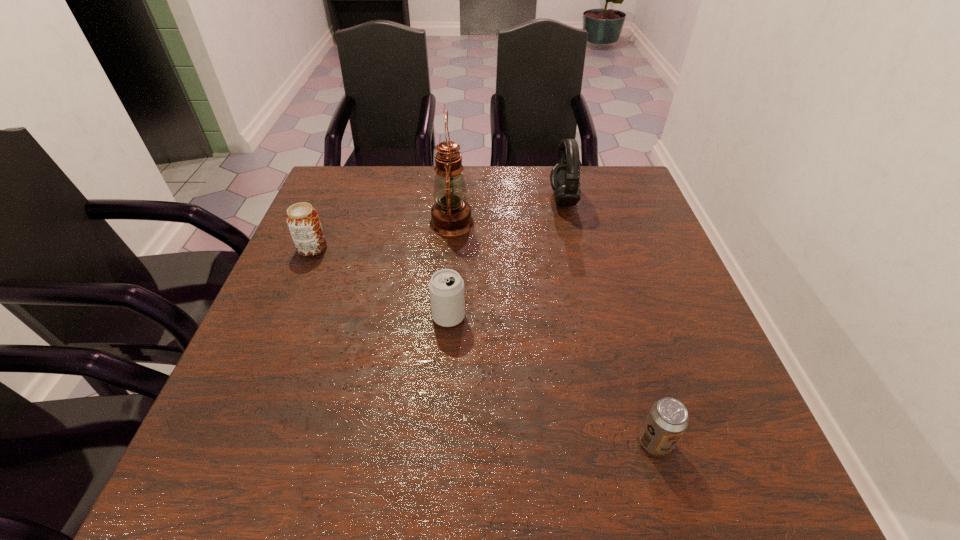
The height and width of the screenshot is (540, 960). In order to click on free space located on the earcups of the fourth shortest object in this screenshot , I will do pyautogui.click(x=421, y=200).

Identify the location of free space located on the right of the farther beer can. (367, 248).

Locate an element on the screen. The height and width of the screenshot is (540, 960). vacant region located on the front of the can is located at coordinates (446, 353).

Where is `vacant space positioned 0.060m on the right of the nearer beer can`? vacant space positioned 0.060m on the right of the nearer beer can is located at coordinates pyautogui.click(x=707, y=442).

At what (x,y) coordinates should I click in order to perform the action: click on oil lamp at the far edge. Please return your answer as a coordinate pair (x, y). The height and width of the screenshot is (540, 960). Looking at the image, I should click on (451, 215).

At what (x,y) coordinates should I click in order to perform the action: click on headset present at the far edge. Please return your answer as a coordinate pair (x, y). Looking at the image, I should click on (565, 175).

Locate an element on the screen. This screenshot has width=960, height=540. object present at the near edge is located at coordinates (667, 419).

You are a GUI agent. You are given a task and a screenshot of the screen. Output one action in this format:
    pyautogui.click(x=<x>, y=<y>)
    Task: Click on the object located at the left edge
    This screenshot has height=540, width=960.
    Given the screenshot: What is the action you would take?
    pyautogui.click(x=302, y=219)

Image resolution: width=960 pixels, height=540 pixels. Find the location of `object positioned at the right edge`. object positioned at the right edge is located at coordinates (667, 419).

Image resolution: width=960 pixels, height=540 pixels. I want to click on object located at the near right corner, so click(x=667, y=419).